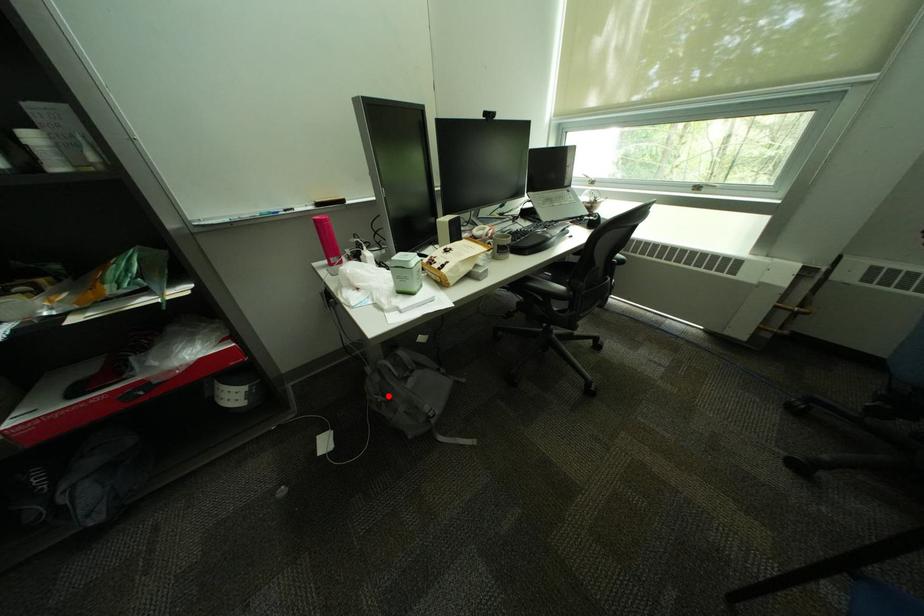
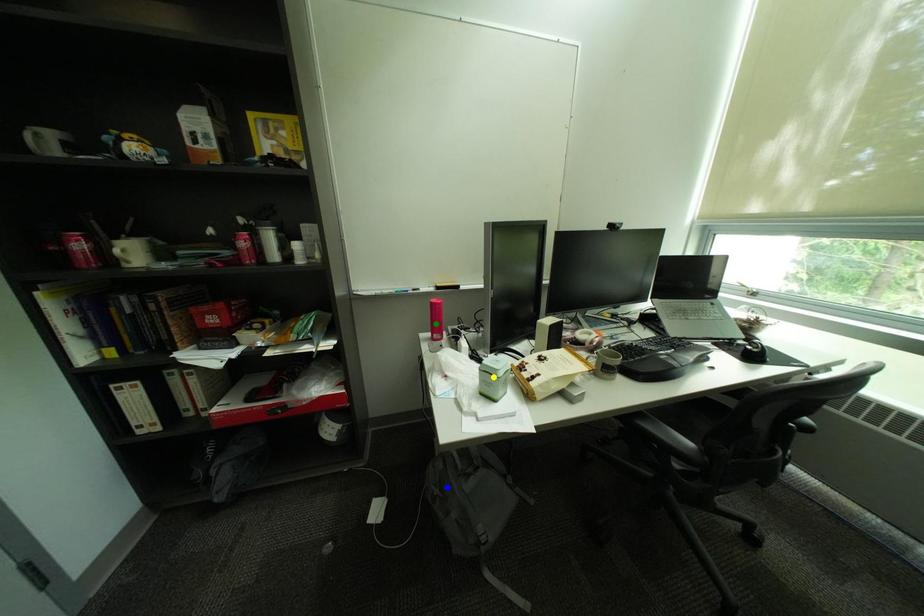
Question: I am providing you with two images of the same scene from different viewpoints. A red point is marked on the first image. You are given multiple points on the second image. Which spot in image 2 lines up with the point in image 1?

Choices:
 (A) yellow point
 (B) green point
 (C) blue point

Answer: (C)